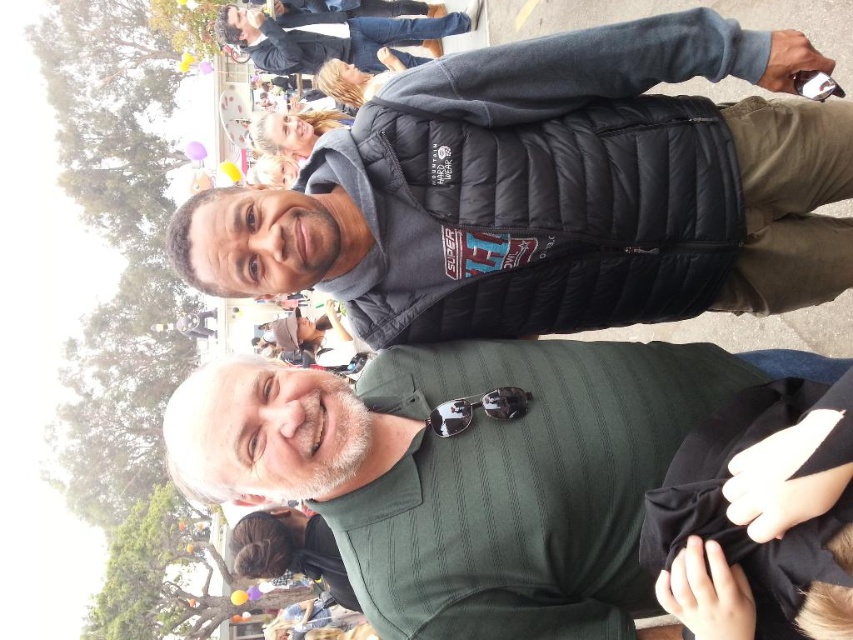
Is green striped shirt at center thinner than black quilted jacket at upper center?

No, green striped shirt at center is not thinner than black quilted jacket at upper center.

Which is behind, point (685, 380) or point (390, 44)?

The point (390, 44) is behind.

Where is `green striped shirt at center`? The width and height of the screenshot is (853, 640). green striped shirt at center is located at coordinates (548, 486).

How far apart are green striped shirt at center and sunglasses at center?

green striped shirt at center and sunglasses at center are 17.50 inches apart from each other.

Measure the distance between point (x=221, y=397) and camera.

The distance of point (x=221, y=397) from camera is 3.16 meters.

Image resolution: width=853 pixels, height=640 pixels. Identify the location of green striped shirt at center. (548, 486).

Who is higher up, black quilted jacket at upper center or sunglasses at center?

black quilted jacket at upper center

Between black quilted jacket at upper center and sunglasses at center, which one appears on the left side from the viewer's perspective?

Positioned to the left is black quilted jacket at upper center.

At what (x,y) coordinates should I click in order to perform the action: click on black quilted jacket at upper center. Please return your answer as a coordinate pair (x, y). Looking at the image, I should click on (329, 36).